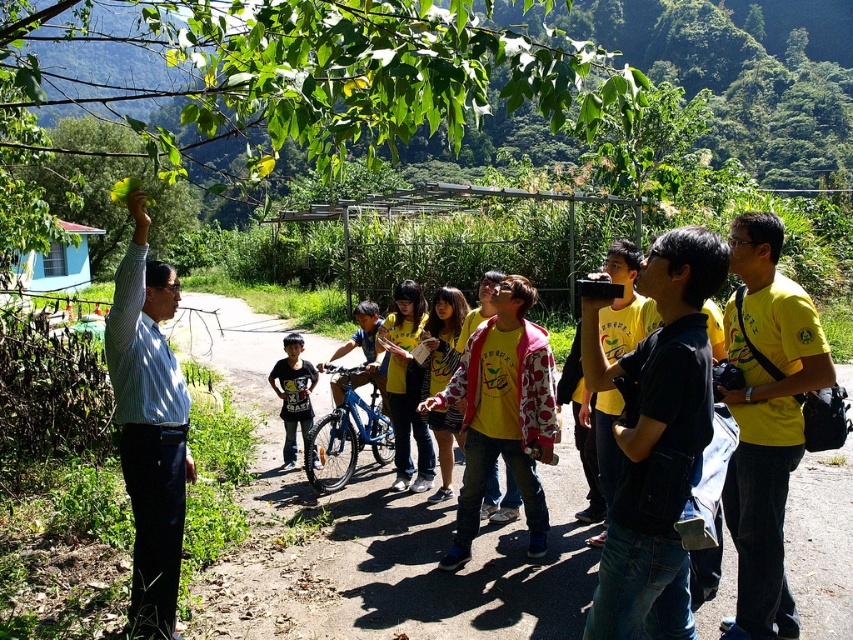
Does black matte shirt at center have a larger size compared to yellow matte shirt at right?

No, black matte shirt at center is not bigger than yellow matte shirt at right.

Does black matte shirt at center have a greater width compared to yellow matte shirt at right?

In fact, black matte shirt at center might be narrower than yellow matte shirt at right.

In order to click on black matte shirt at center in this screenshot , I will do (x=654, y=440).

Between point (123, 371) and point (287, 355), which one is positioned in front?

Point (123, 371) is in front.

Between striped cotton shirt at center and dark blue t-shirt at center, which one has less height?

dark blue t-shirt at center is shorter.

Between point (169, 291) and point (270, 378), which one is positioned in front?

Point (169, 291) is more forward.

This screenshot has width=853, height=640. In order to click on striped cotton shirt at center in this screenshot , I will do `click(149, 422)`.

Does brown dirt path at center have a lesser height compared to yellow matte shirt at right?

Correct, brown dirt path at center is not as tall as yellow matte shirt at right.

The height and width of the screenshot is (640, 853). Describe the element at coordinates (381, 540) in the screenshot. I see `brown dirt path at center` at that location.

Find the location of `brown dirt path at center`. brown dirt path at center is located at coordinates (381, 540).